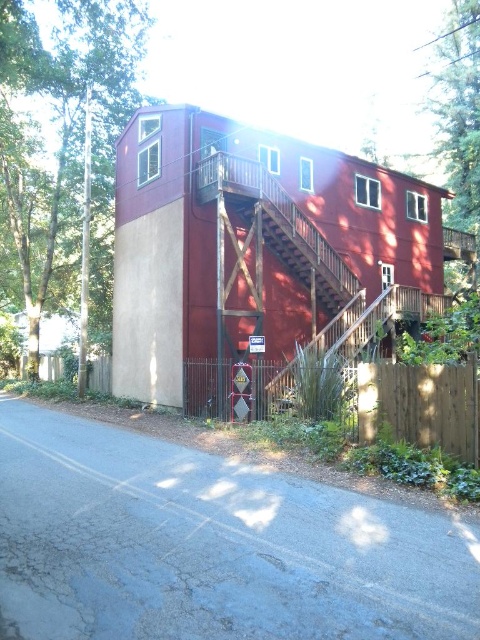
Which is more to the right, green leafy tree at left or wooden fence at lower left?

From the viewer's perspective, wooden fence at lower left appears more on the right side.

Can you confirm if green leafy tree at left is shorter than wooden fence at lower left?

Incorrect, green leafy tree at left's height does not fall short of wooden fence at lower left's.

Where is `green leafy tree at left`? This screenshot has width=480, height=640. green leafy tree at left is located at coordinates (63, 138).

At what (x,y) coordinates should I click in order to perform the action: click on green leafy tree at left. Please return your answer as a coordinate pair (x, y). This screenshot has height=640, width=480. Looking at the image, I should click on (63, 138).